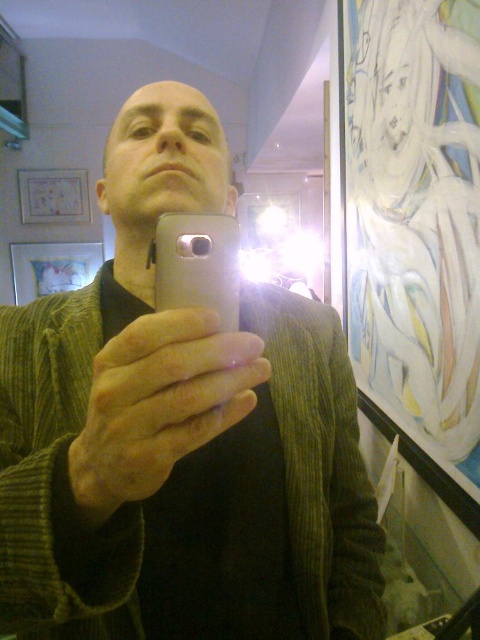
Question: Can you confirm if matte silver phone at center is thinner than silver metallic phone at center?

Choices:
 (A) yes
 (B) no

Answer: (B)

Question: Among these objects, which one is farthest from the camera?

Choices:
 (A) matte silver phone at center
 (B) silver metallic phone at center

Answer: (B)

Question: Is matte silver phone at center positioned before silver metallic phone at center?

Choices:
 (A) no
 (B) yes

Answer: (B)

Question: Which of the following is the closest to the observer?

Choices:
 (A) matte silver phone at center
 (B) silver metallic phone at center

Answer: (A)

Question: Is matte silver phone at center further to camera compared to silver metallic phone at center?

Choices:
 (A) yes
 (B) no

Answer: (B)